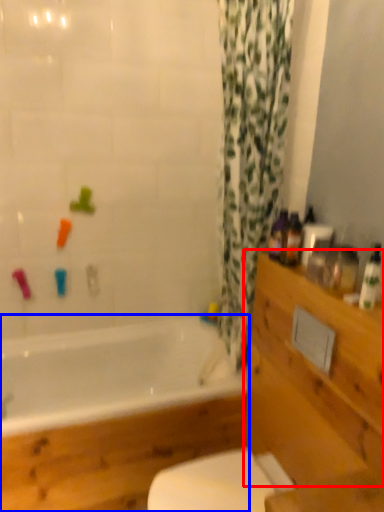
Question: Which of the following is the farthest to the observer, drawer (highlighted by a red box) or bathtub (highlighted by a blue box)?

Choices:
 (A) drawer
 (B) bathtub

Answer: (B)